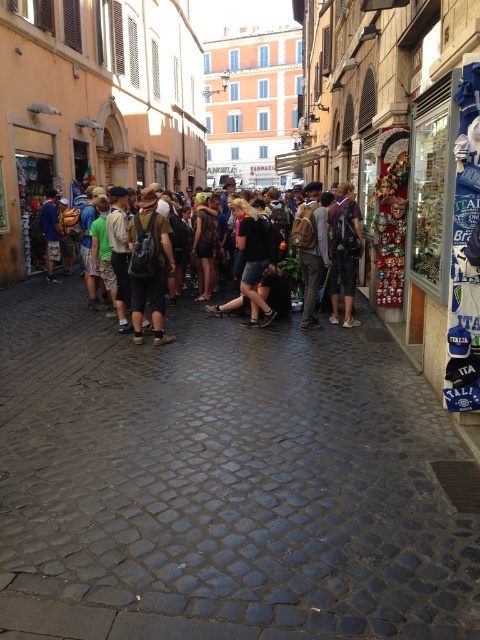
Does dark gray cobblestone at center come in front of dark brown leather jacket at center?

Yes, it is.

Can you confirm if dark gray cobblestone at center is positioned to the left of dark brown leather jacket at center?

No, dark gray cobblestone at center is not to the left of dark brown leather jacket at center.

Is point (95, 509) more distant than point (210, 193)?

No, it is in front of (210, 193).

You are a GUI agent. You are given a task and a screenshot of the screen. Output one action in this format:
    pyautogui.click(x=<x>, y=<y>)
    Task: Click on the dark gray cobblestone at center
    
    Given the screenshot: What is the action you would take?
    pyautogui.click(x=222, y=483)

Which is in front, point (320, 188) or point (252, 272)?

Positioned in front is point (252, 272).

Does brown backpack at center lie behind denim shorts at center?

No, brown backpack at center is closer to the viewer.

Who is more distant from viewer, [312,212] or [240,228]?

Positioned behind is point [240,228].

Identify the location of brown backpack at center. The width and height of the screenshot is (480, 640). (311, 248).

Which is in front, point (268, 246) or point (216, 216)?

Point (268, 246) is in front.

I want to click on multicolored backpacks at center, so click(x=253, y=259).

You are a GUI agent. You are given a task and a screenshot of the screen. Output one action in this format:
    pyautogui.click(x=<x>, y=<y>)
    Task: Click on the multicolored backpacks at center
    This screenshot has width=480, height=640.
    Given the screenshot: What is the action you would take?
    pyautogui.click(x=253, y=259)